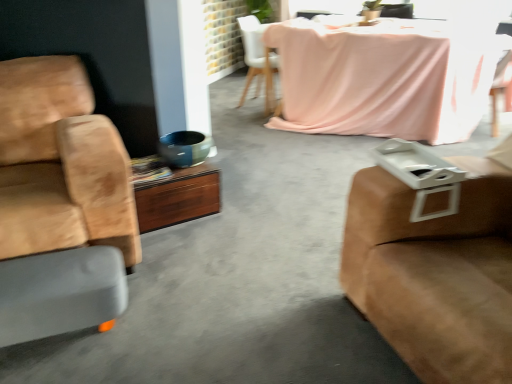
You are a GUI agent. You are given a task and a screenshot of the screen. Output one action in this format:
    pyautogui.click(x=<x>, y=<y>)
    Task: Click on the free point to the right of gray rubber footrest at lower left
    
    Given the screenshot: What is the action you would take?
    pyautogui.click(x=159, y=327)